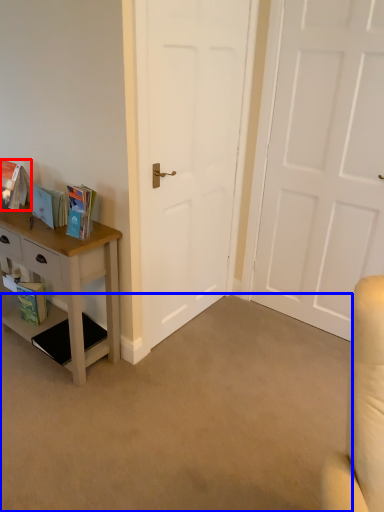
Question: Which object is closer to the camera taking this photo, book (highlighted by a red box) or plain (highlighted by a blue box)?

Choices:
 (A) book
 (B) plain

Answer: (B)